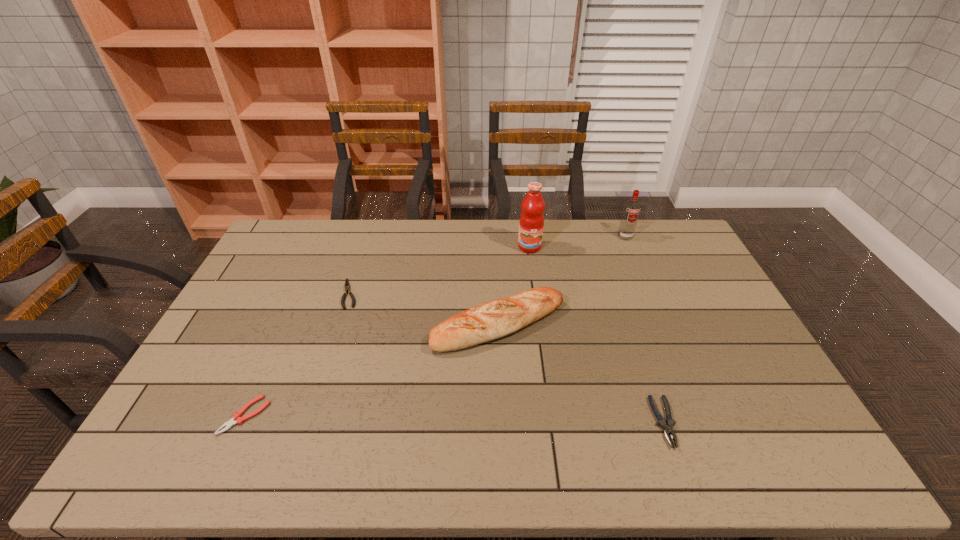
You are a GUI agent. You are given a task and a screenshot of the screen. Output one action in this format:
    pyautogui.click(x=<x>, y=<y>)
    Task: Click on the tallest object
    The image size is (960, 540).
    Given the screenshot: What is the action you would take?
    pyautogui.click(x=531, y=223)

Where is `the rightmost object`? This screenshot has height=540, width=960. the rightmost object is located at coordinates (631, 211).

At what (x,y) coordinates should I click in order to perform the action: click on the second tallest object. Please return your answer as a coordinate pair (x, y). The image size is (960, 540). Looking at the image, I should click on (631, 211).

Identify the location of baguet. This screenshot has height=540, width=960. (491, 320).

I want to click on the fifth object from left to right, so click(668, 429).

What are the coordinates of `the tallest pliers` in the screenshot? It's located at (668, 429).

Image resolution: width=960 pixels, height=540 pixels. Find the location of `the second pliers from left to right`. the second pliers from left to right is located at coordinates (347, 286).

At what (x,y) coordinates should I click in order to perform the action: click on the farthest pliers. Please return your answer as a coordinate pair (x, y). Looking at the image, I should click on (347, 286).

The image size is (960, 540). Identify the location of the leftmost pliers. (236, 419).

Locate an element on the screen. The image size is (960, 540). vacant space located 0.350m on the front label of the fruit juice is located at coordinates (540, 324).